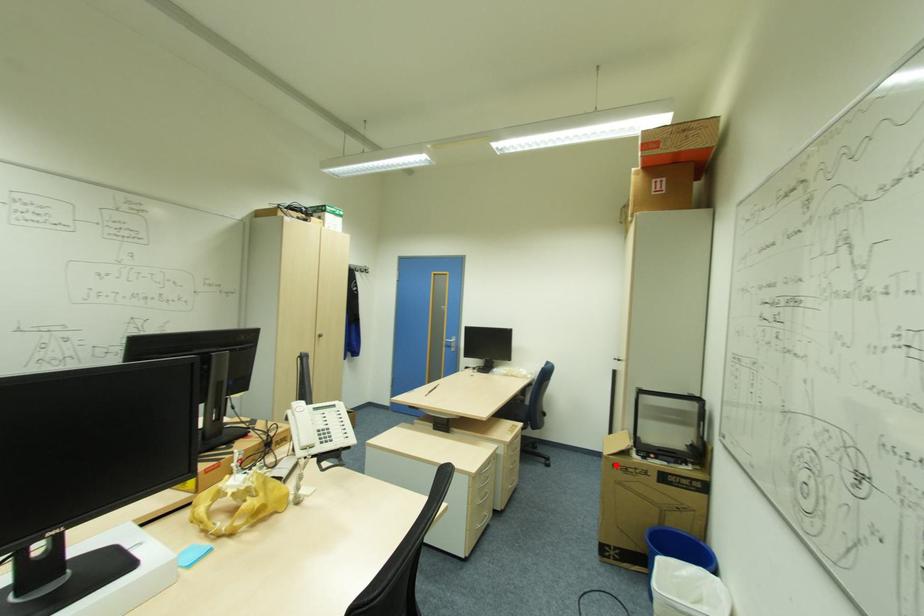
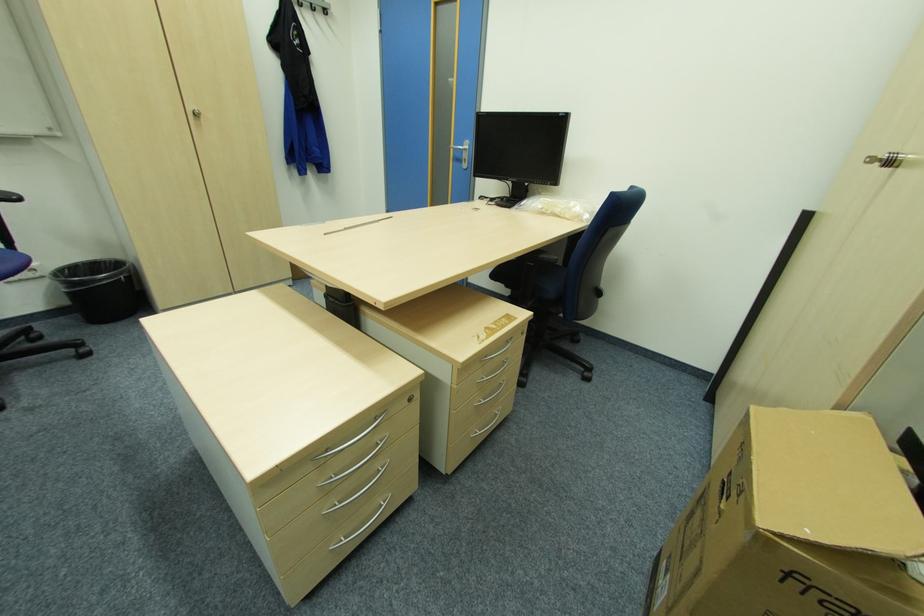
Question: I am providing you with two images of the same scene from different viewpoints. A red point is marked on the first image. Can you still see the location of the red point in image 2?

Choices:
 (A) Yes
 (B) No

Answer: (A)